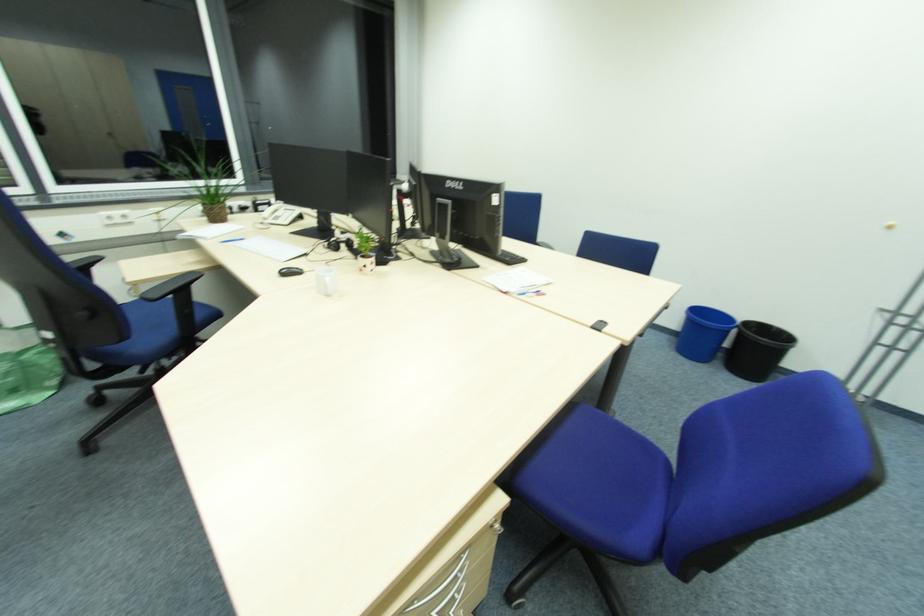
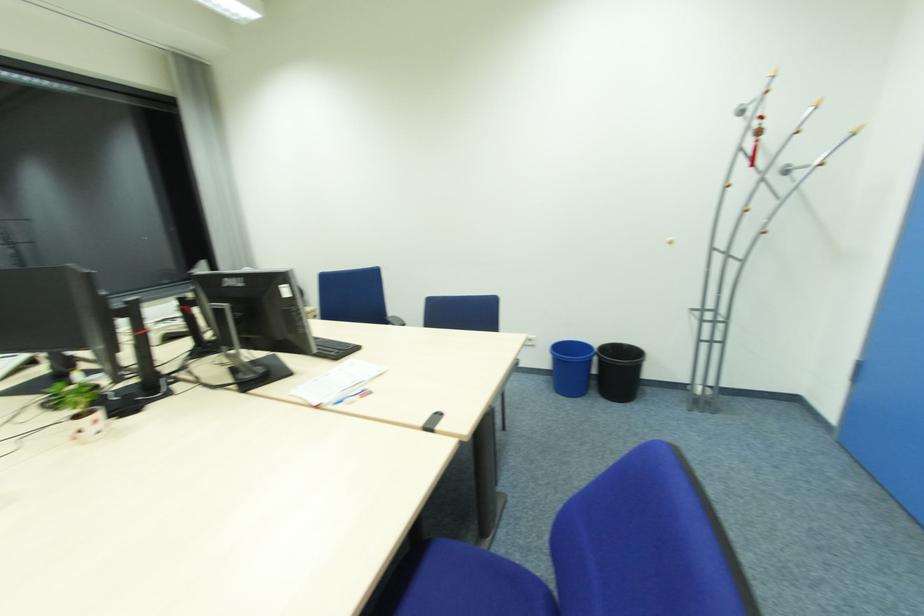
Question: The camera is either moving clockwise (left) or counter-clockwise (right) around the object. The first image is from the beginning of the video and the second image is from the end. Is the camera moving left or right when shooting the video?

Choices:
 (A) Left
 (B) Right

Answer: (A)